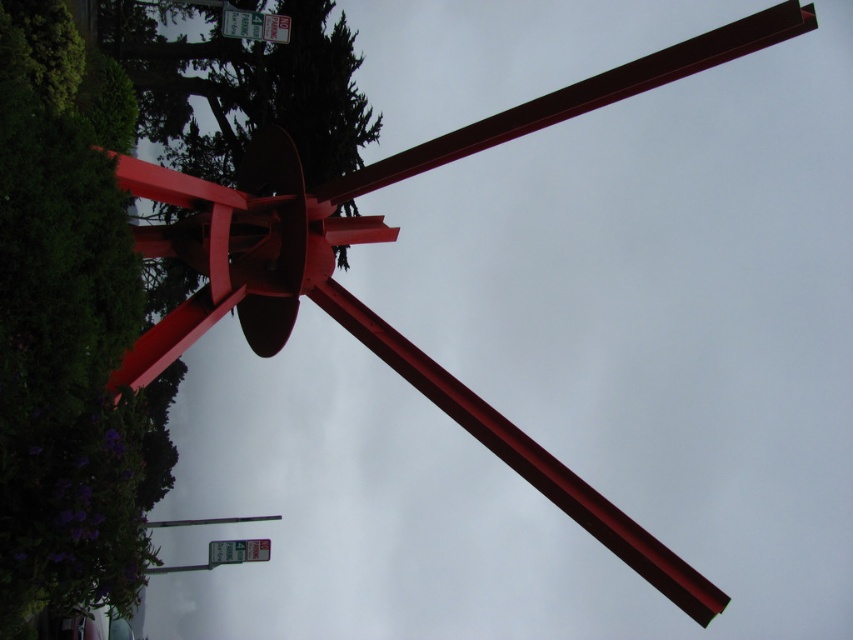
Measure the distance from white plastic sign at upper left to metallic green street sign at lower center.

A distance of 26.94 meters exists between white plastic sign at upper left and metallic green street sign at lower center.

Is point (262, 40) more distant than point (230, 554)?

No, (262, 40) is in front of (230, 554).

Is point (241, 17) farther from viewer compared to point (238, 552)?

No, (241, 17) is in front of (238, 552).

I want to click on white plastic sign at upper left, so click(254, 26).

Which of these two, green leafy tree at upper left or metallic green street sign at lower center, stands shorter?

metallic green street sign at lower center is shorter.

Where is `green leafy tree at upper left`? This screenshot has width=853, height=640. green leafy tree at upper left is located at coordinates (67, 326).

Is point (30, 129) less distant than point (260, 545)?

That is True.

The height and width of the screenshot is (640, 853). What are the coordinates of `green leafy tree at upper left` in the screenshot? It's located at (67, 326).

Does green leafy tree at upper left appear over white plastic sign at upper left?

Incorrect, green leafy tree at upper left is not positioned above white plastic sign at upper left.

Is green leafy tree at upper left positioned in front of white plastic sign at upper left?

That is True.

Who is more distant from viewer, (105,392) or (288,35)?

The point (288,35) is more distant.

At what (x,y) coordinates should I click in order to perform the action: click on green leafy tree at upper left. Please return your answer as a coordinate pair (x, y). Looking at the image, I should click on 67,326.